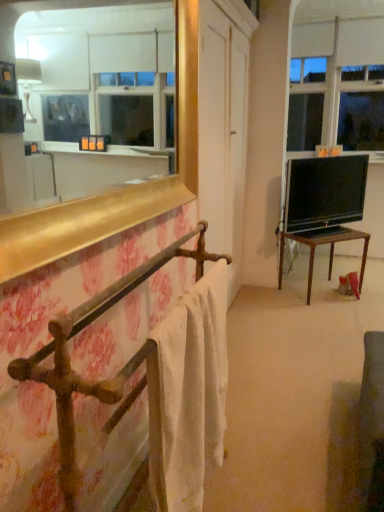
In order to face wooden table at right, should I rotate leftwards or rightwards?

A 17.056 degree turn to the right will do.

Image resolution: width=384 pixels, height=512 pixels. Find the location of `white cotton towel at left`. white cotton towel at left is located at coordinates (189, 394).

Locate an element on the screen. Image resolution: width=384 pixels, height=512 pixels. rusty metal towel rack at left is located at coordinates (80, 331).

Where is `television above the wooden table at right (from a real-world perspective)`? The image size is (384, 512). television above the wooden table at right (from a real-world perspective) is located at coordinates (324, 193).

Does black glossy tv at right have a lesser height compared to wooden table at right?

No, black glossy tv at right is not shorter than wooden table at right.

From the image's perspective, between black glossy tv at right and wooden table at right, which one is located above?

black glossy tv at right appears higher in the image.

Measure the distance from black glossy tv at right to wooden table at right.

black glossy tv at right is 9.89 inches away from wooden table at right.

Does black glossy tv at right contain white cotton towel at left?

No, white cotton towel at left is not a part of black glossy tv at right.

How distant is black glossy tv at right from white cotton towel at left?

black glossy tv at right is 6.70 feet from white cotton towel at left.

Can you confirm if black glossy tv at right is taller than white cotton towel at left?

No.

Looking at this image, can you confirm if black glossy tv at right is smaller than white cotton towel at left?

Indeed, black glossy tv at right has a smaller size compared to white cotton towel at left.

Does point (360, 234) come closer to viewer compared to point (336, 137)?

Yes, point (360, 234) is in front of point (336, 137).

Is transparent glass window at upper right completely or partially inside wooden table at right?

No, transparent glass window at upper right is not inside wooden table at right.

How far apart are wooden table at right and transparent glass window at upper right?

wooden table at right and transparent glass window at upper right are 5.20 feet apart from each other.

Based on the photo, how many degrees apart are the facing directions of wooden table at right and transparent glass window at upper right?

There is a 41.4-degree angle between the facing directions of wooden table at right and transparent glass window at upper right.

This screenshot has width=384, height=512. Find the location of `bath towel behind the rusty metal towel rack at left`. bath towel behind the rusty metal towel rack at left is located at coordinates (189, 394).

Considering the positions of objects rusty metal towel rack at left and white cotton towel at left in the image provided, who is behind, rusty metal towel rack at left or white cotton towel at left?

white cotton towel at left is more distant.

Is point (58, 420) farther from viewer compared to point (178, 336)?

No, it is in front of (178, 336).

Is rusty metal towel rack at left outside of wooden table at right?

That's correct, rusty metal towel rack at left is outside of wooden table at right.

Is rusty metal towel rack at left to the right of wooden table at right from the viewer's perspective?

Incorrect, rusty metal towel rack at left is not on the right side of wooden table at right.

From a real-world perspective, is rusty metal towel rack at left below wooden table at right?

Incorrect, from a real-world perspective, rusty metal towel rack at left is higher than wooden table at right.

From the image's perspective, between rusty metal towel rack at left and wooden table at right, who is located below?

rusty metal towel rack at left appears lower in the image.

Is transparent glass window at upper right situated inside black glossy tv at right or outside?

transparent glass window at upper right is not inside black glossy tv at right, it's outside.

Is transparent glass window at upper right with black glossy tv at right?

There is a gap between transparent glass window at upper right and black glossy tv at right.

Considering the relative sizes of transparent glass window at upper right and black glossy tv at right in the image provided, is transparent glass window at upper right smaller than black glossy tv at right?

No.

Which object is thinner, white cotton towel at left or wooden table at right?

white cotton towel at left is thinner.

Is white cotton towel at left positioned with its back to wooden table at right?

That's not correct — white cotton towel at left is not looking away from wooden table at right.

From the picture: From the image's perspective, is white cotton towel at left over wooden table at right?

No, from the image's perspective, white cotton towel at left is not on top of wooden table at right.

This screenshot has height=512, width=384. Find the location of `television above the wooden table at right (from a real-world perspective)`. television above the wooden table at right (from a real-world perspective) is located at coordinates (324, 193).

This screenshot has height=512, width=384. Identify the location of television behind the white cotton towel at left. (324, 193).

Looking at the image, which one is located closer to black glossy tv at right, rusty metal towel rack at left or wooden table at right?

wooden table at right is positioned closer to the anchor black glossy tv at right.

From the image, which object appears to be farther from white cotton towel at left, transparent glass window at upper right or wooden table at right?

transparent glass window at upper right is further to white cotton towel at left.

Considering their positions, is white cotton towel at left positioned further to transparent glass window at upper right than rusty metal towel rack at left?

white cotton towel at left is further to transparent glass window at upper right.

Estimate the real-world distances between objects in this image. Which object is closer to white cotton towel at left, rusty metal towel rack at left or wooden table at right?

rusty metal towel rack at left is closer to white cotton towel at left.

From the image, which object appears to be nearer to transparent glass window at upper right, white cotton towel at left or wooden table at right?

wooden table at right.

Which object lies nearer to the anchor point wooden table at right, black glossy tv at right or rusty metal towel rack at left?

black glossy tv at right is positioned closer to the anchor wooden table at right.

Estimate the real-world distances between objects in this image. Which object is closer to wooden table at right, white cotton towel at left or transparent glass window at upper right?

transparent glass window at upper right is positioned closer to the anchor wooden table at right.

When comparing their distances from transparent glass window at upper right, does rusty metal towel rack at left or wooden table at right seem closer?

wooden table at right lies closer to transparent glass window at upper right than the other object.

The height and width of the screenshot is (512, 384). In order to click on bath towel between rusty metal towel rack at left and transparent glass window at upper right from front to back in this screenshot , I will do `click(189, 394)`.

Where is `television located between white cotton towel at left and wooden table at right in the depth direction`? This screenshot has width=384, height=512. television located between white cotton towel at left and wooden table at right in the depth direction is located at coordinates (324, 193).

Where is `table between rusty metal towel rack at left and transparent glass window at upper right in the front-back direction`? table between rusty metal towel rack at left and transparent glass window at upper right in the front-back direction is located at coordinates (324, 244).

Locate an element on the screen. The width and height of the screenshot is (384, 512). television between rusty metal towel rack at left and wooden table at right along the z-axis is located at coordinates (324, 193).